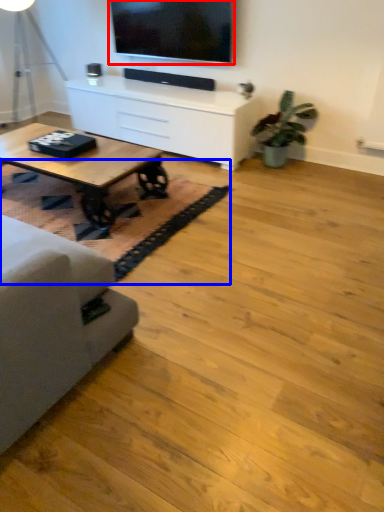
Question: Among these objects, which one is nearest to the camera, television (highlighted by a red box) or mat (highlighted by a blue box)?

Choices:
 (A) television
 (B) mat

Answer: (B)